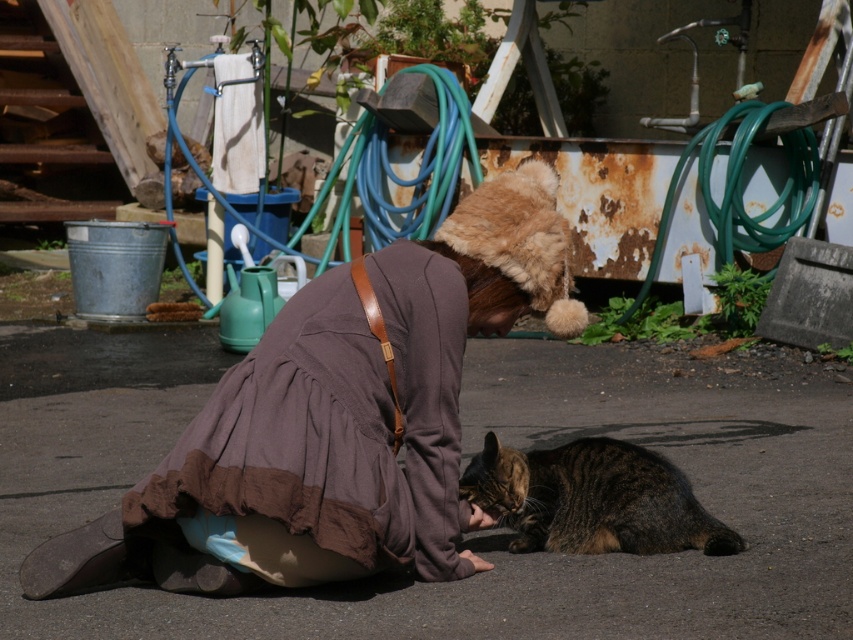
Is tabby fur cat at lower center positioned in front of blue rubber hose at upper center?

Yes, it is in front of blue rubber hose at upper center.

Which is in front, point (537, 541) or point (434, 182)?

Point (537, 541) is in front.

Between point (669, 490) and point (471, 144), which one is positioned in front?

Point (669, 490)

This screenshot has height=640, width=853. Find the location of `tabby fur cat at lower center`. tabby fur cat at lower center is located at coordinates (592, 499).

Is point (256, 433) positioned behind point (310, 216)?

No, it is in front of (310, 216).

Is the position of brown cotton robe at center less distant than that of blue rubber hose at upper center?

Yes, it is.

Where is `brown cotton robe at center`? brown cotton robe at center is located at coordinates (338, 422).

Image resolution: width=853 pixels, height=640 pixels. Identify the location of brown cotton robe at center. (338, 422).

Does brown cotton robe at center appear on the right side of tabby fur cat at lower center?

In fact, brown cotton robe at center is to the left of tabby fur cat at lower center.

Between brown cotton robe at center and tabby fur cat at lower center, which one is positioned lower?

tabby fur cat at lower center is below.

At what (x,y) coordinates should I click in order to perform the action: click on brown cotton robe at center. Please return your answer as a coordinate pair (x, y). Looking at the image, I should click on (338, 422).

The width and height of the screenshot is (853, 640). In order to click on brown cotton robe at center in this screenshot , I will do `click(338, 422)`.